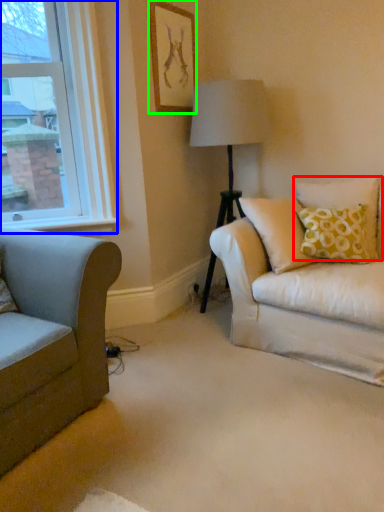
Question: Which object is positioned closest to pillow (highlighted by a red box)? Select from window (highlighted by a blue box) and picture frame (highlighted by a green box).

Choices:
 (A) window
 (B) picture frame

Answer: (B)